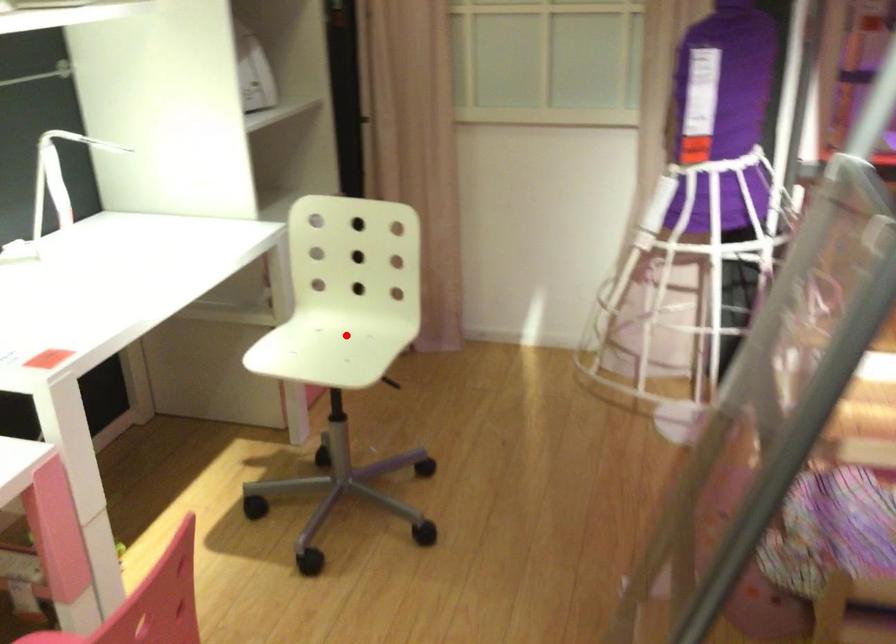
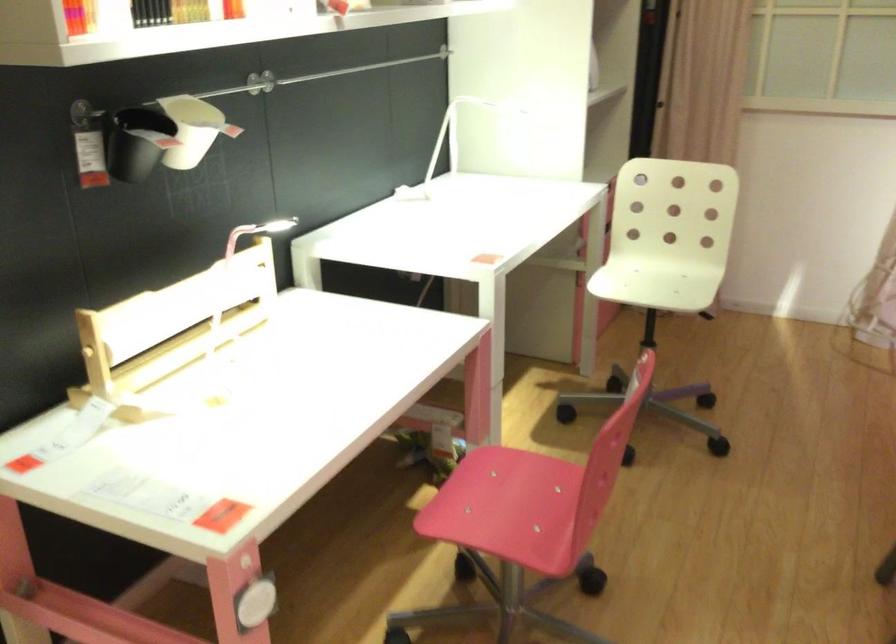
Where in the second image is the point corresponding to the highlighted location from the first image?

(668, 277)